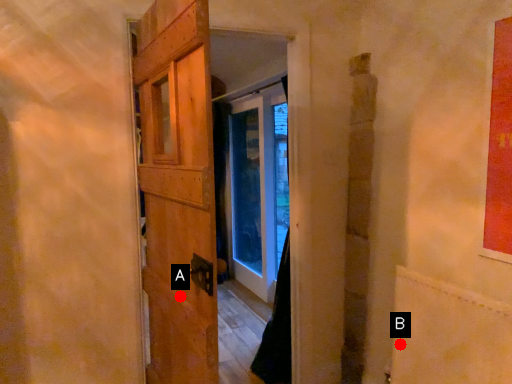
Question: Two points are circled on the image, labeled by A and B beside each circle. Which point is closer to the camera taking this photo?

Choices:
 (A) A is closer
 (B) B is closer

Answer: (A)